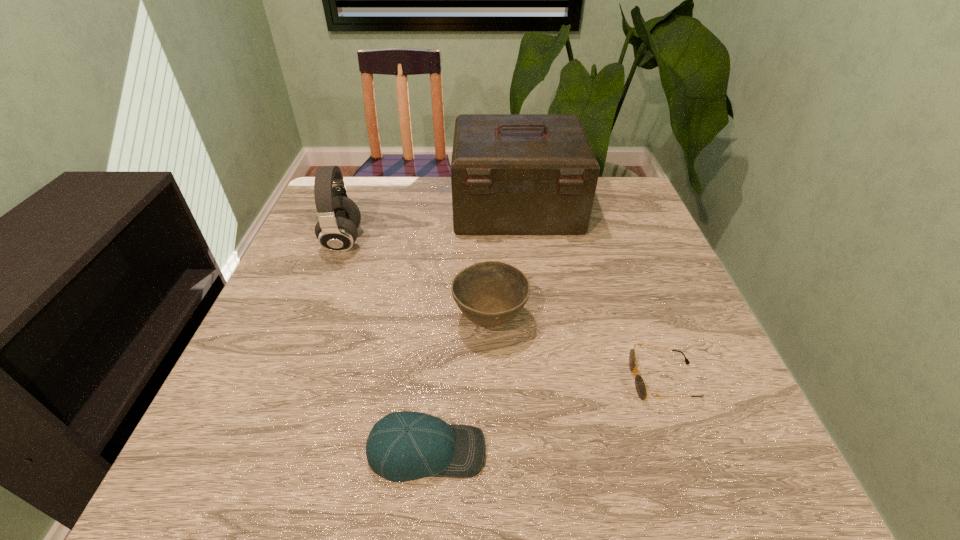
Locate an element on the screen. Image resolution: width=960 pixels, height=540 pixels. object that is positioned at the right edge is located at coordinates (641, 388).

Locate an element on the screen. Image resolution: width=960 pixels, height=540 pixels. object that is at the far left corner is located at coordinates pos(339,217).

The width and height of the screenshot is (960, 540). In the image, there is a desktop. Find the location of `vacant space at the near edge`. vacant space at the near edge is located at coordinates (330, 443).

What are the coordinates of `vacant position at the left edge of the desktop` in the screenshot? It's located at (278, 300).

You are a GUI agent. You are given a task and a screenshot of the screen. Output one action in this format:
    pyautogui.click(x=<x>, y=<y>)
    Task: Click on the free space at the right edge of the desktop
    
    Given the screenshot: What is the action you would take?
    pyautogui.click(x=644, y=242)

The width and height of the screenshot is (960, 540). In the image, there is a desktop. Identify the location of vacant space at the far left corner. (351, 179).

This screenshot has height=540, width=960. In order to click on vacant area at the near left corner of the desktop in this screenshot , I will do `click(209, 454)`.

I want to click on free point at the far right corner, so click(x=636, y=214).

In the image, there is a desktop. Where is `vacant space at the near right corner`? Image resolution: width=960 pixels, height=540 pixels. vacant space at the near right corner is located at coordinates (756, 481).

The width and height of the screenshot is (960, 540). Find the location of `empty location between the nearest object and the tallest object`. empty location between the nearest object and the tallest object is located at coordinates (471, 329).